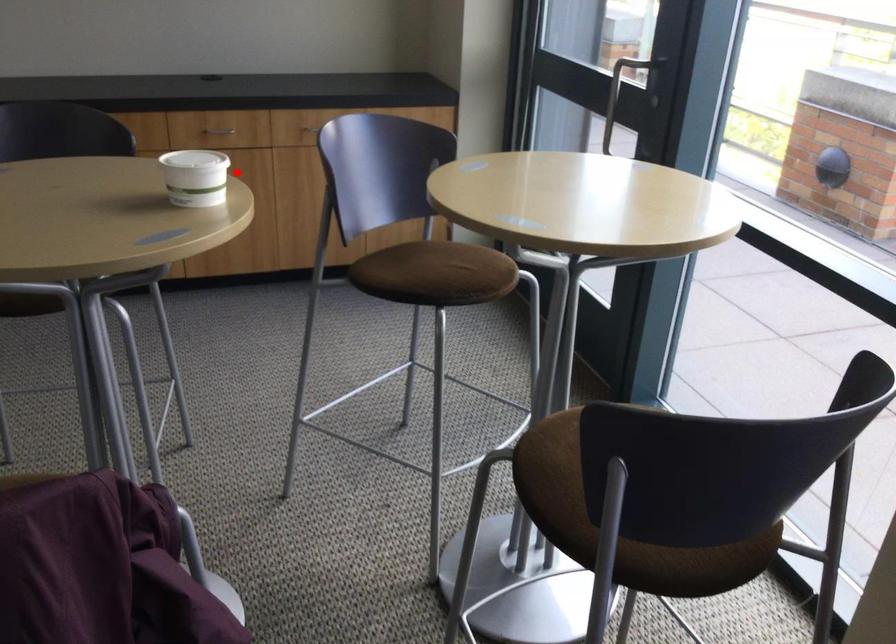
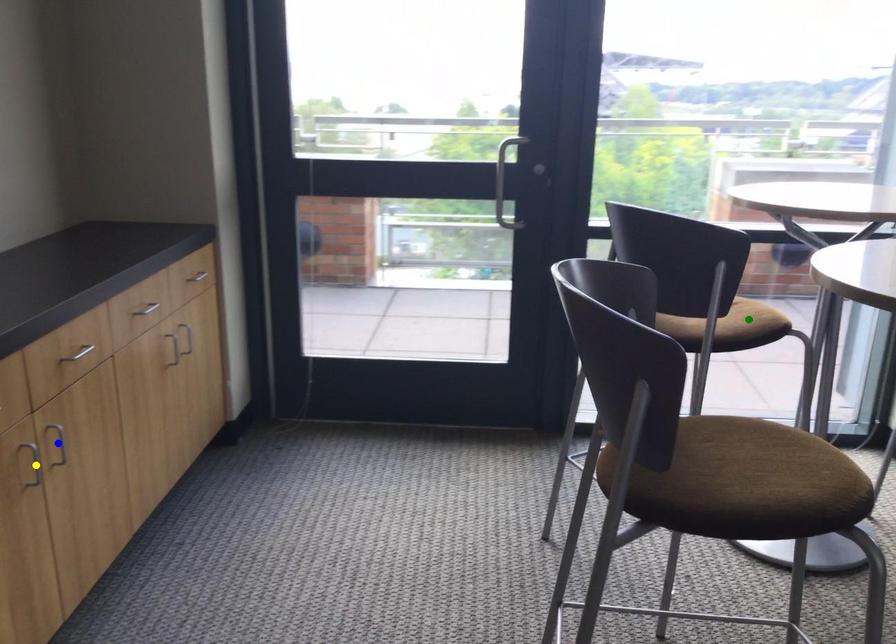
Question: I am providing you with two images of the same scene from different viewpoints. A red point is marked on the first image. You are given multiple points on the second image. Which mark in image 2 goes with the point in image 1?

Choices:
 (A) blue point
 (B) yellow point
 (C) green point

Answer: (B)